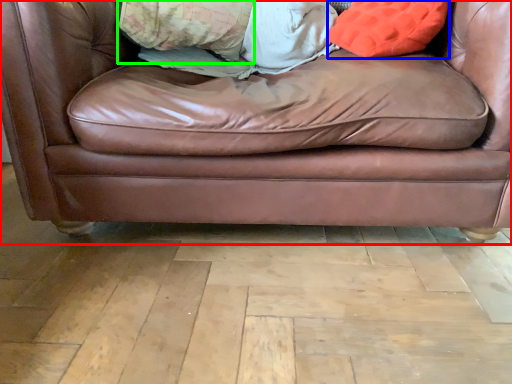
Question: Considering the real-world distances, which object is closest to studio couch (highlighted by a red box)? throw pillow (highlighted by a blue box) or pillow (highlighted by a green box).

Choices:
 (A) throw pillow
 (B) pillow

Answer: (A)